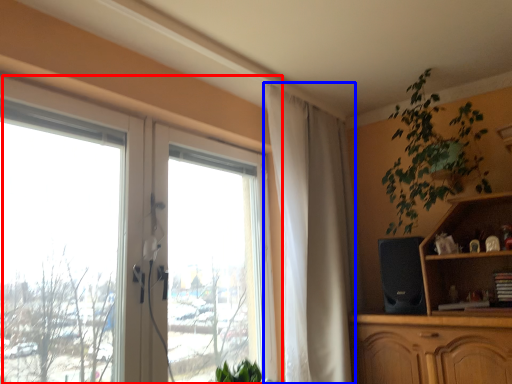
Question: Which object is closer to the camera taking this photo, window (highlighted by a red box) or curtain (highlighted by a blue box)?

Choices:
 (A) window
 (B) curtain

Answer: (A)